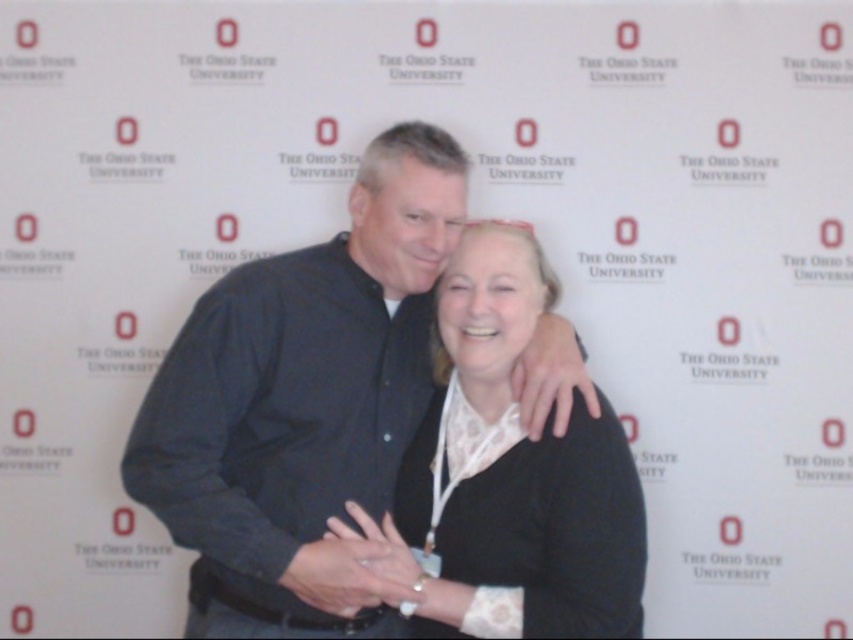
Question: Which of the following is the farthest from the observer?

Choices:
 (A) (467, 248)
 (B) (360, 634)

Answer: (A)

Question: Is black matte shirt at center positioned in front of black matte sweater at center?

Choices:
 (A) yes
 (B) no

Answer: (A)

Question: Among these points, which one is farthest from the camera?

Choices:
 (A) (566, 420)
 (B) (555, 612)

Answer: (A)

Question: Which point is farther to the camera?

Choices:
 (A) black matte shirt at center
 (B) black matte sweater at center

Answer: (B)

Question: Can you confirm if black matte shirt at center is positioned to the right of black matte sweater at center?

Choices:
 (A) yes
 (B) no

Answer: (B)

Question: Does black matte shirt at center have a smaller size compared to black matte sweater at center?

Choices:
 (A) no
 (B) yes

Answer: (A)